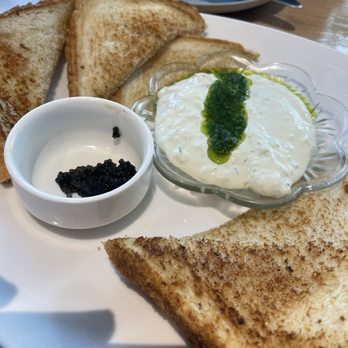
Find the location of a particular element. silver tip of utensil is located at coordinates (297, 5).